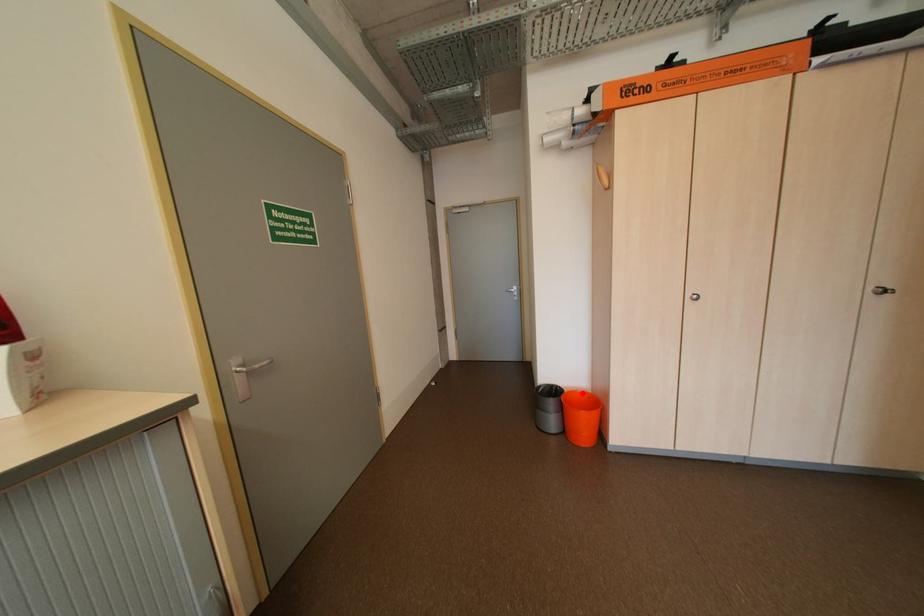
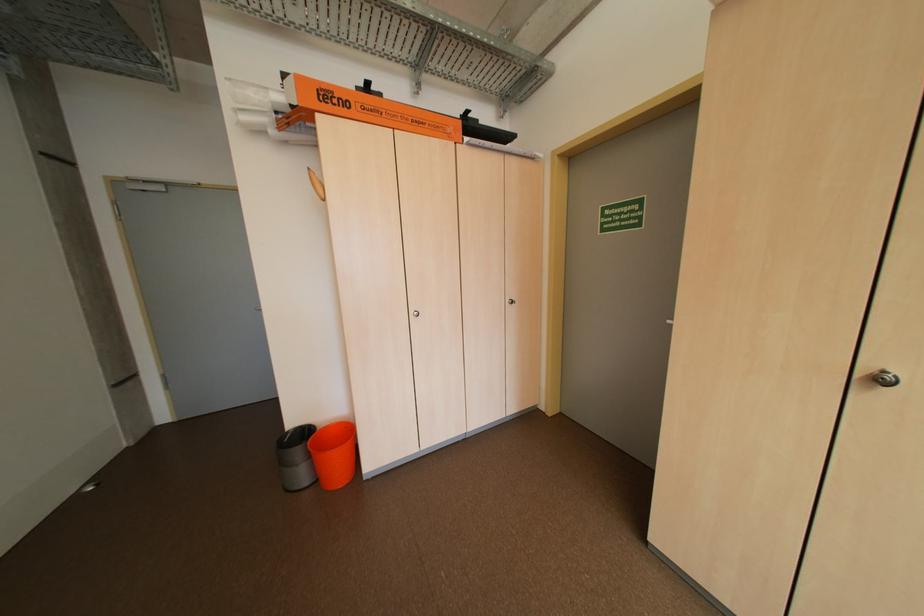
Where in the second image is the point corresponding to the highlighted location from the first image?

(335, 429)